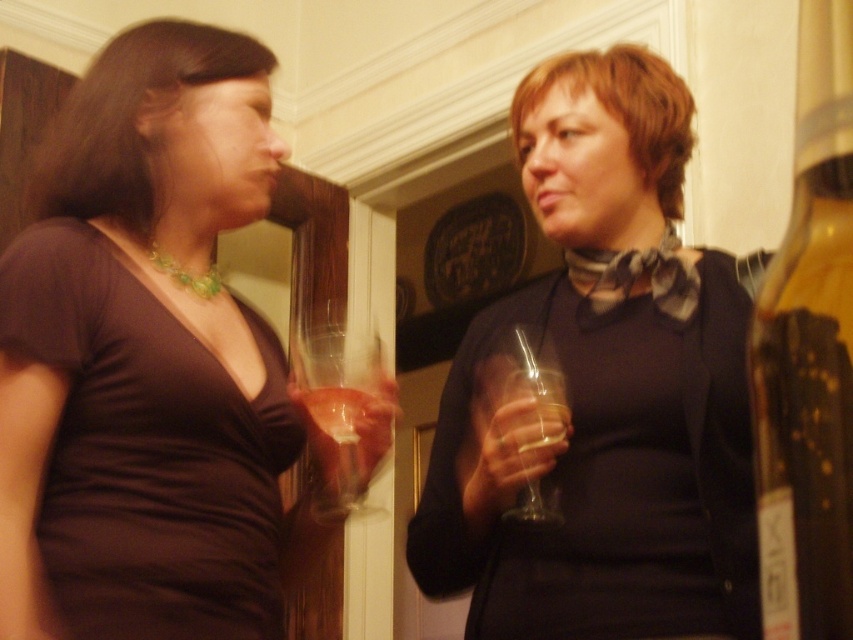
Does transparent glass at center have a larger size compared to transparent glass wine glass at right?

Answer: Incorrect, transparent glass at center is not larger than transparent glass wine glass at right.

Between transparent glass at center and transparent glass wine glass at right, which one has less height?

transparent glass at center

Consider the image. Who is more distant from viewer, (331,356) or (526,484)?

The point (331,356) is more distant.

You are a GUI agent. You are given a task and a screenshot of the screen. Output one action in this format:
    pyautogui.click(x=<x>, y=<y>)
    Task: Click on the transparent glass at center
    
    Given the screenshot: What is the action you would take?
    pyautogui.click(x=339, y=406)

Is matte brown blouse at left positioned before translucent glass bottle at right?

No, matte brown blouse at left is further to the viewer.

Is matte brown blouse at left taller than translucent glass bottle at right?

Yes, matte brown blouse at left is taller than translucent glass bottle at right.

Who is more distant from viewer, (131, 579) or (822, 502)?

The point (131, 579) is more distant.

At what (x,y) coordinates should I click in order to perform the action: click on matte brown blouse at left. Please return your answer as a coordinate pair (x, y). The height and width of the screenshot is (640, 853). Looking at the image, I should click on (148, 360).

Does translucent glass bottle at right appear under transparent glass at center?

No, translucent glass bottle at right is not below transparent glass at center.

Who is shorter, translucent glass bottle at right or transparent glass at center?

transparent glass at center

Find the location of a particular element. This screenshot has width=853, height=640. translucent glass bottle at right is located at coordinates (809, 355).